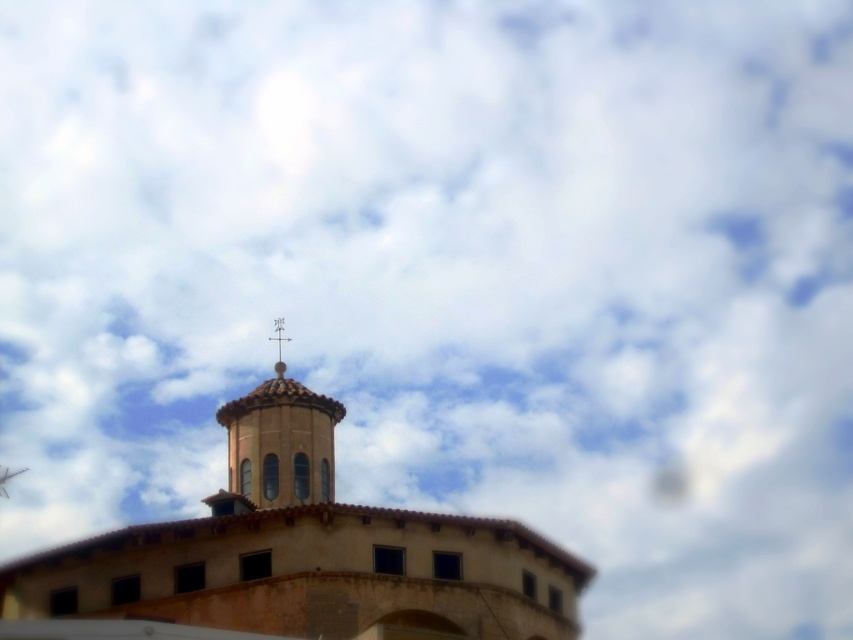
Between point (172, 573) and point (292, 502), which one is positioned behind?

The point (292, 502) is more distant.

Is brown textured dome at center to the left of matte orange bell tower at center from the viewer's perspective?

Correct, you'll find brown textured dome at center to the left of matte orange bell tower at center.

At what (x,y) coordinates should I click in order to perform the action: click on brown textured dome at center. Please return your answer as a coordinate pair (x, y). Image resolution: width=853 pixels, height=640 pixels. Looking at the image, I should click on [302, 554].

Consider the image. Who is shorter, matte orange bell tower at center or metallic cross at upper center?

metallic cross at upper center is shorter.

Can you confirm if matte orange bell tower at center is positioned above metallic cross at upper center?

Actually, matte orange bell tower at center is below metallic cross at upper center.

Who is more forward, (328, 460) or (287, 340)?

Point (328, 460) is more forward.

Image resolution: width=853 pixels, height=640 pixels. Find the location of `matte orange bell tower at center`. matte orange bell tower at center is located at coordinates (277, 445).

Is point (320, 465) positioned before point (271, 339)?

Yes, it is.

Who is shorter, brown textured dome at center or metallic cross at upper center?

Standing shorter between the two is metallic cross at upper center.

Does point (413, 518) come behind point (277, 328)?

No.

At what (x,y) coordinates should I click in order to perform the action: click on brown textured dome at center. Please return your answer as a coordinate pair (x, y). The width and height of the screenshot is (853, 640). Looking at the image, I should click on (302, 554).